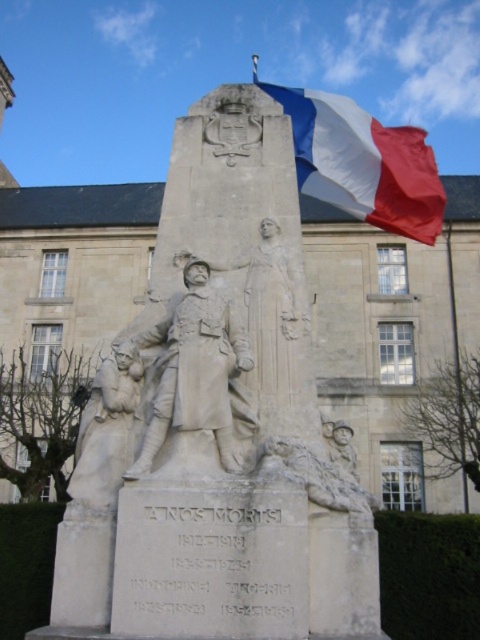
Question: Can you confirm if tricolor fabric flag at upper right is thinner than white marble statue at lower left?

Choices:
 (A) yes
 (B) no

Answer: (B)

Question: Estimate the real-world distances between objects in this image. Which object is closer to the white marble statue at lower left?

Choices:
 (A) tricolor fabric flag at upper right
 (B) white stone soldier at center

Answer: (B)

Question: Does tricolor fabric flag at upper right have a smaller size compared to white stone soldier at center?

Choices:
 (A) no
 (B) yes

Answer: (A)

Question: Which object is positioned closest to the white stone soldier at center?

Choices:
 (A) tricolor fabric flag at upper right
 (B) white marble statue at lower left

Answer: (B)

Question: Can you confirm if tricolor fabric flag at upper right is positioned above white stone soldier at center?

Choices:
 (A) yes
 (B) no

Answer: (A)

Question: Considering the real-world distances, which object is closest to the white stone soldier at center?

Choices:
 (A) white marble monument at center
 (B) white marble statue at lower left

Answer: (B)